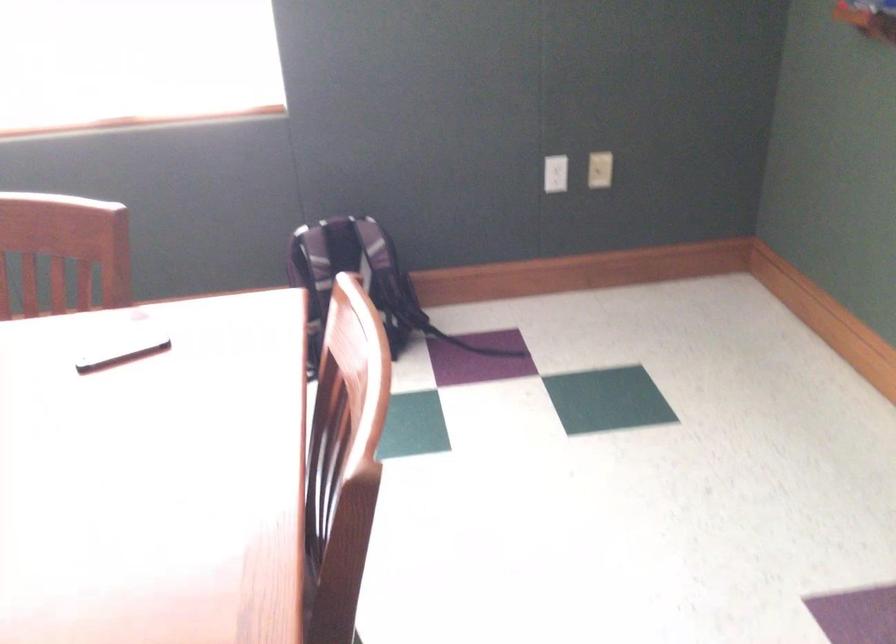
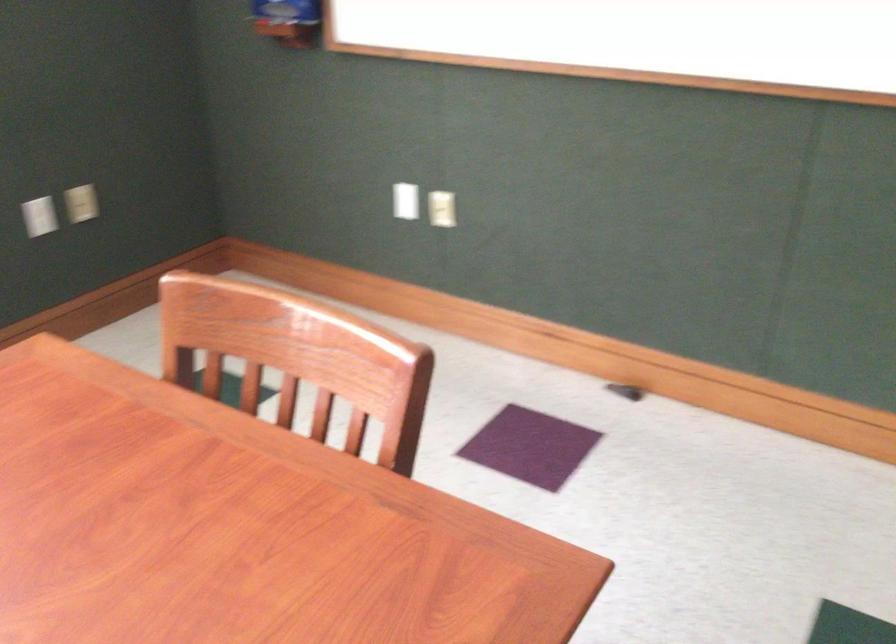
Question: The camera is either moving clockwise (left) or counter-clockwise (right) around the object. The first image is from the beginning of the video and the second image is from the end. Is the camera moving left or right when shooting the video?

Choices:
 (A) Left
 (B) Right

Answer: (A)